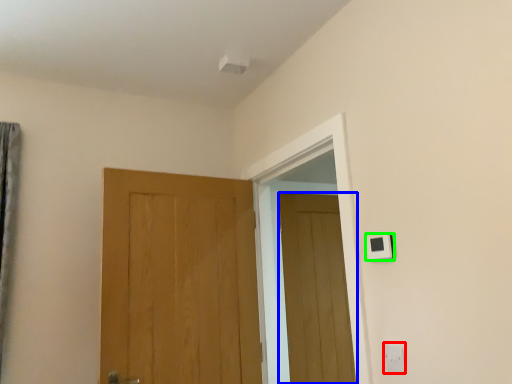
Question: Which object is positioned closest to electric outlet (highlighted by a red box)? Select from door (highlighted by a blue box) and light switch (highlighted by a green box).

Choices:
 (A) door
 (B) light switch

Answer: (B)